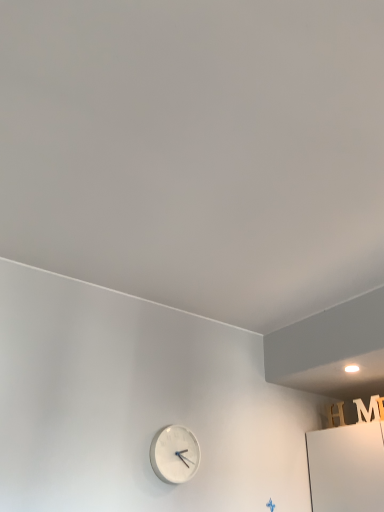
What do you see at coordinates (367, 410) in the screenshot? The image size is (384, 512). I see `white matte letter m at upper right` at bounding box center [367, 410].

Identify the location of white matte letter m at upper right. (367, 410).

The width and height of the screenshot is (384, 512). What do you see at coordinates (174, 454) in the screenshot? I see `white matte clock at lower center` at bounding box center [174, 454].

Find the location of a particular element. The width and height of the screenshot is (384, 512). white matte clock at lower center is located at coordinates (174, 454).

Identify the location of white matte letter m at upper right. Image resolution: width=384 pixels, height=512 pixels. (367, 410).

Can you confirm if white matte clock at lower center is positioned to the left of white matte letter m at upper right?

Yes.

Which object is further away from the camera, white matte clock at lower center or white matte letter m at upper right?

white matte letter m at upper right is further from the camera.

Which is behind, point (159, 435) or point (372, 405)?

The point (372, 405) is farther from the camera.

From the image's perspective, between white matte clock at lower center and white matte letter m at upper right, who is located below?

From the image's view, white matte clock at lower center is below.

From a real-world perspective, is white matte clock at lower center positioned under white matte letter m at upper right based on gravity?

Yes, from a real-world perspective, white matte clock at lower center is below white matte letter m at upper right.

Is white matte clock at lower center wider than white matte letter m at upper right?

Yes, white matte clock at lower center is wider than white matte letter m at upper right.

Between white matte clock at lower center and white matte letter m at upper right, which one has more height?

white matte clock at lower center.

Who is smaller, white matte clock at lower center or white matte letter m at upper right?

Smaller between the two is white matte letter m at upper right.

Would you say white matte letter m at upper right is part of white matte clock at lower center's contents?

Definitely not — white matte letter m at upper right is not inside white matte clock at lower center.

Are white matte clock at lower center and white matte letter m at upper right located far from each other?

No, white matte clock at lower center is not far away from white matte letter m at upper right.

Consider the image. Is white matte clock at lower center facing towards white matte letter m at upper right?

No, white matte clock at lower center is not turned towards white matte letter m at upper right.

How different are the orientations of white matte clock at lower center and white matte letter m at upper right in degrees?

white matte clock at lower center and white matte letter m at upper right are facing 85.9 degrees away from each other.

How distant is white matte clock at lower center from white matte letter m at upper right?

white matte clock at lower center and white matte letter m at upper right are 31.84 inches apart.

This screenshot has width=384, height=512. Identify the location of letter behind the white matte clock at lower center. (367, 410).

Is white matte letter m at upper right at the right side of white matte clock at lower center?

Correct, you'll find white matte letter m at upper right to the right of white matte clock at lower center.

Between white matte letter m at upper right and white matte clock at lower center, which one is positioned in front?

white matte clock at lower center.

Which is farther from the camera, (375, 411) or (184, 428)?

The point (375, 411) is behind.

In the scene shown: From the image's perspective, is white matte letter m at upper right located above or below white matte clock at lower center?

Based on their image positions, white matte letter m at upper right is located above white matte clock at lower center.

From a real-world perspective, is white matte letter m at upper right over white matte clock at lower center?

Yes, from a real-world perspective, white matte letter m at upper right is over white matte clock at lower center

Does white matte letter m at upper right have a lesser width compared to white matte clock at lower center?

Yes, white matte letter m at upper right is thinner than white matte clock at lower center.

Between white matte letter m at upper right and white matte clock at lower center, which one has less height?

With less height is white matte letter m at upper right.

Which of these two, white matte letter m at upper right or white matte clock at lower center, is bigger?

white matte clock at lower center is bigger.

Is white matte clock at lower center located within white matte letter m at upper right?

No, white matte clock at lower center is located outside of white matte letter m at upper right.

Are white matte letter m at upper right and white matte clock at lower center beside each other?

No, white matte letter m at upper right is not making contact with white matte clock at lower center.

Is white matte letter m at upper right looking in the opposite direction of white matte clock at lower center?

No, white matte clock at lower center is not at the back of white matte letter m at upper right.

How many degrees apart are the facing directions of white matte letter m at upper right and white matte clock at lower center?

85.9 degrees separate the facing orientations of white matte letter m at upper right and white matte clock at lower center.

The width and height of the screenshot is (384, 512). I want to click on wall clock in front of the white matte letter m at upper right, so click(174, 454).

In order to click on wall clock on the left of white matte letter m at upper right in this screenshot , I will do `click(174, 454)`.

Locate an element on the screen. The image size is (384, 512). letter above the white matte clock at lower center (from a real-world perspective) is located at coordinates (367, 410).